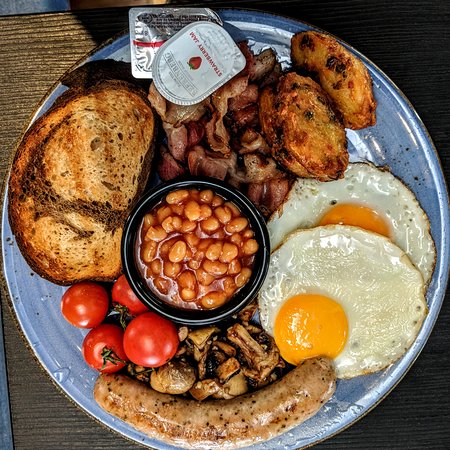
I want to click on plate, so click(406, 137).